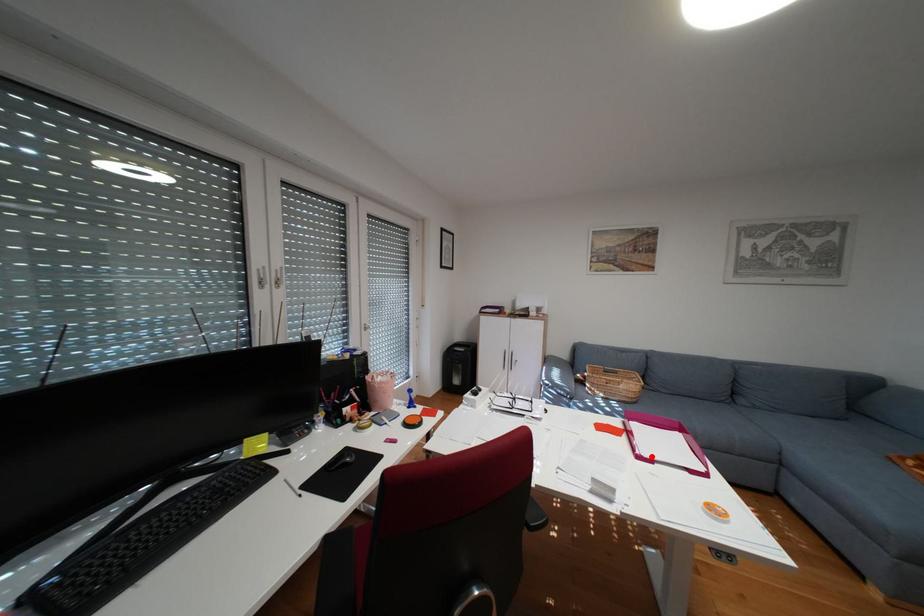
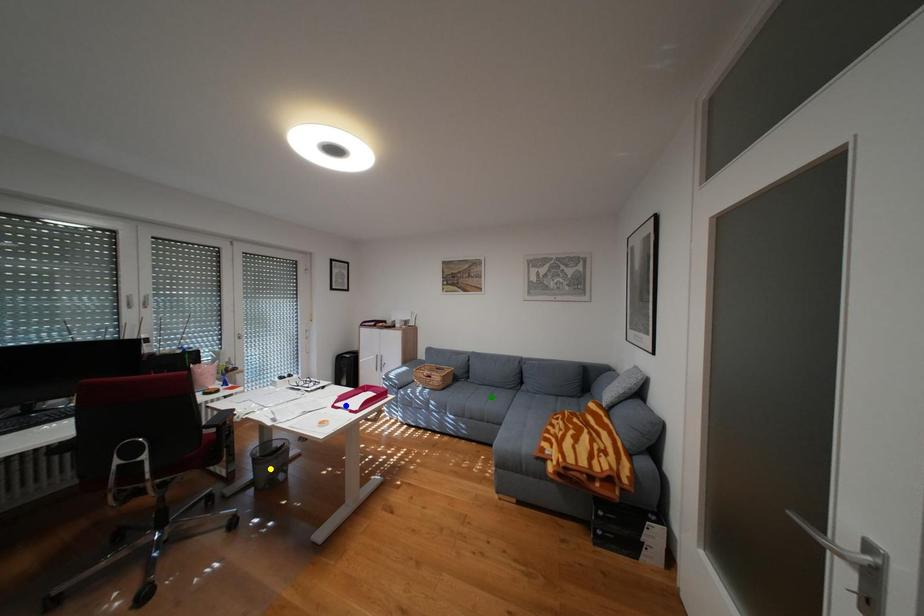
Question: I am providing you with two images of the same scene from different viewpoints. A red point is marked on the first image. You are given multiple points on the second image. In image 2, which mark is for the same physical point as the one in image 1?

Choices:
 (A) green point
 (B) blue point
 (C) yellow point

Answer: (B)